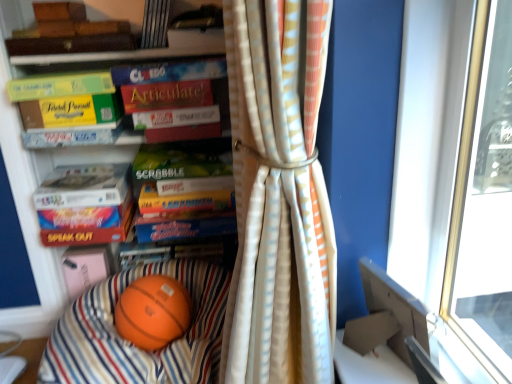
Question: Considering the positions of green matte scrabble board game at center, which is the fourth paperback book from bottom to top, and matte green paperback book at left, placed as the 5th paperback book when sorted from bottom to top, in the image, is green matte scrabble board game at center, which is the fourth paperback book from bottom to top, wider or thinner than matte green paperback book at left, placed as the 5th paperback book when sorted from bottom to top,?

Choices:
 (A) thin
 (B) wide

Answer: (B)

Question: Considering the positions of green matte scrabble board game at center, marked as the ninth paperback book in a top-to-bottom arrangement, and matte green paperback book at left, which is counted as the 8th paperback book, starting from the top, in the image, is green matte scrabble board game at center, marked as the ninth paperback book in a top-to-bottom arrangement, bigger or smaller than matte green paperback book at left, which is counted as the 8th paperback book, starting from the top,?

Choices:
 (A) small
 (B) big

Answer: (B)

Question: Which is nearer to the green cardboard game box at left, which appears as the eighth paperback book when ordered from the bottom?

Choices:
 (A) orange rubber basketball at center
 (B) green matte book at upper left, placed as the 10th paperback book when sorted from bottom to top
 (C) white matte paper at center, which is the 6th paperback book in top-to-bottom order
 (D) matte white paperback book at center, which is counted as the seventh paperback book, starting from the top
 (E) rubberized orange ball at lower left

Answer: (B)

Question: Based on their relative distances, which object is nearer to the hardcover book at upper center, which is the third book in back-to-front order?

Choices:
 (A) hardcover book at upper center, which is the 3th book in bottom-to-top order
 (B) white striped curtain at center
 (C) green cardboard game box at left, which appears as the fifth paperback book when viewed from the top
 (D) orange matte basketball at lower center
 (E) matte white paperback book at center, which is counted as the seventh paperback book, starting from the top

Answer: (A)